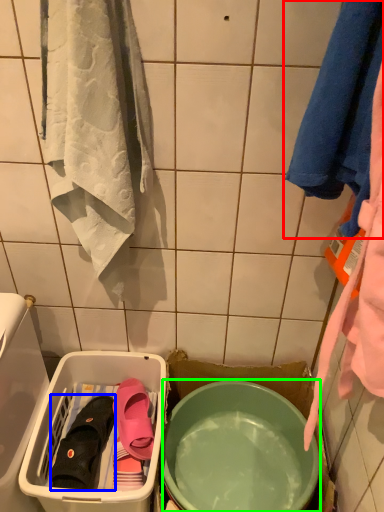
Question: Which is nearer to the towel (highlighted by a red box)? footwear (highlighted by a blue box) or mixing bowl (highlighted by a green box).

Choices:
 (A) footwear
 (B) mixing bowl

Answer: (B)